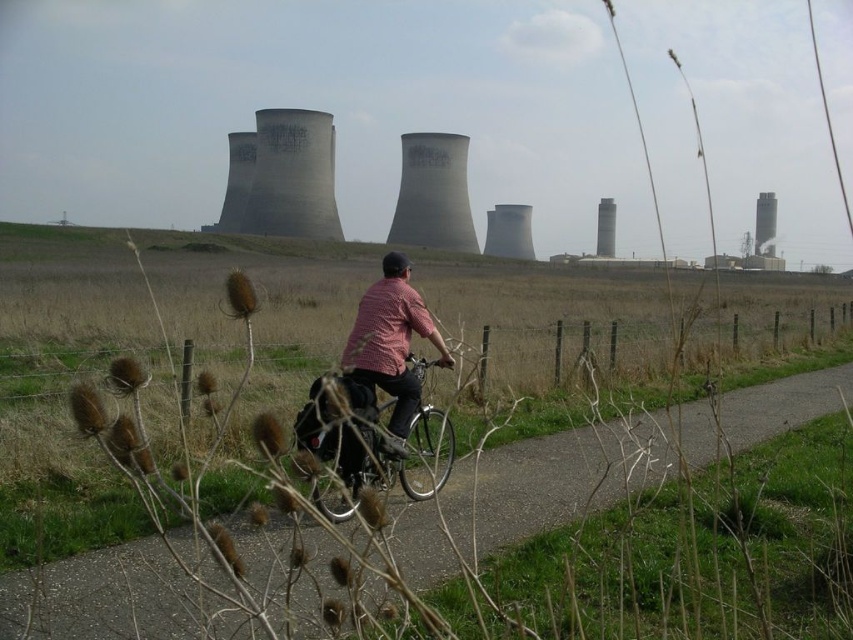
Question: Is smooth asphalt path at center wider than shiny metallic bicycle at center?

Choices:
 (A) yes
 (B) no

Answer: (A)

Question: Which object is positioned closest to the checkered fabric shirt at center?

Choices:
 (A) smooth gray tower at upper right
 (B) shiny metallic bicycle at center

Answer: (B)

Question: Which object is positioned closest to the smooth gray tower at upper right?

Choices:
 (A) smooth concrete tower at center
 (B) shiny metallic bicycle at center

Answer: (A)

Question: Does checkered fabric shirt at center appear over smooth gray tower at upper right?

Choices:
 (A) yes
 (B) no

Answer: (B)

Question: Does checkered fabric shirt at center have a lesser width compared to smooth gray tower at upper right?

Choices:
 (A) yes
 (B) no

Answer: (A)

Question: Based on their relative distances, which object is farther from the smooth gray tower at upper right?

Choices:
 (A) smooth asphalt path at center
 (B) shiny metallic bicycle at center
 (C) checkered fabric shirt at center

Answer: (B)